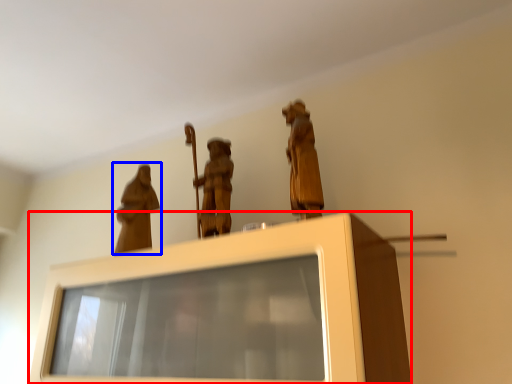
Question: Which point is further to the camera, furniture (highlighted by a red box) or person (highlighted by a blue box)?

Choices:
 (A) furniture
 (B) person

Answer: (B)